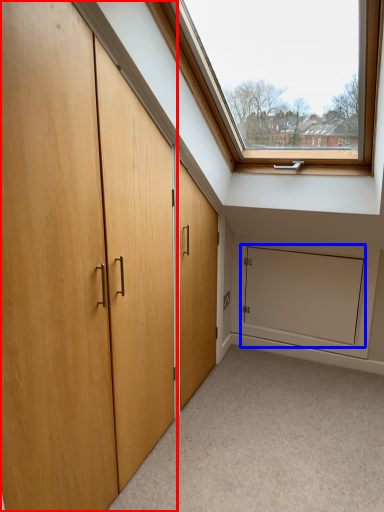
Question: Which object appears closest to the camera in this image, door (highlighted by a red box) or screen door (highlighted by a blue box)?

Choices:
 (A) door
 (B) screen door

Answer: (A)